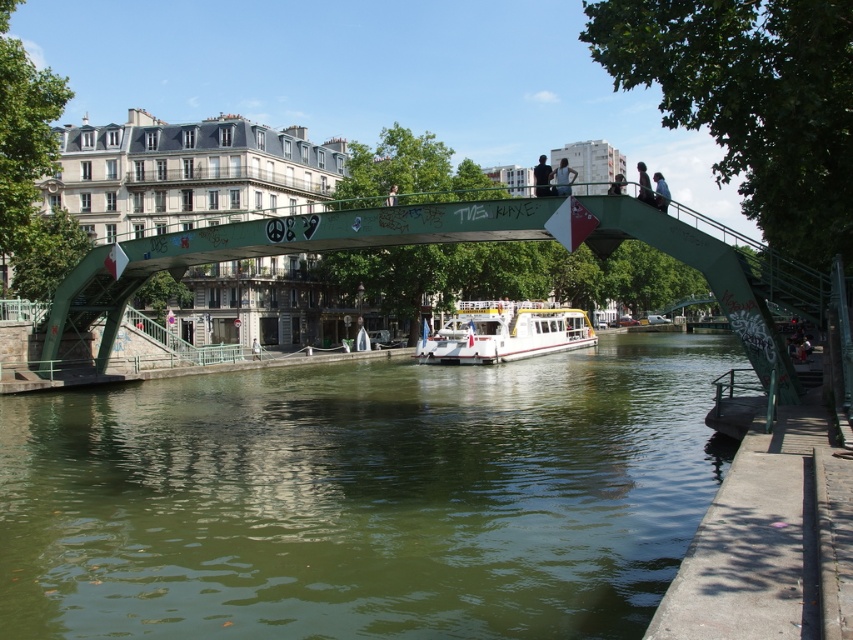
You are standing at the green pedestrian bridge and want to take a photo of the two points marked in the scene. Which point, point (276, 544) or point (560, 168), will appear larger in your camera view?

Point (276, 544) will appear larger in your camera view because it is closer to the camera than point (560, 168).